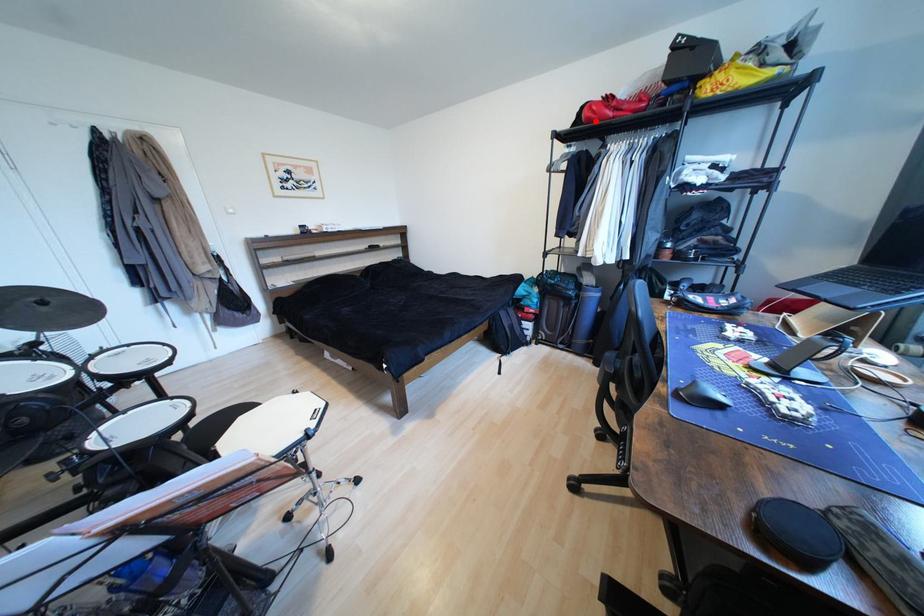
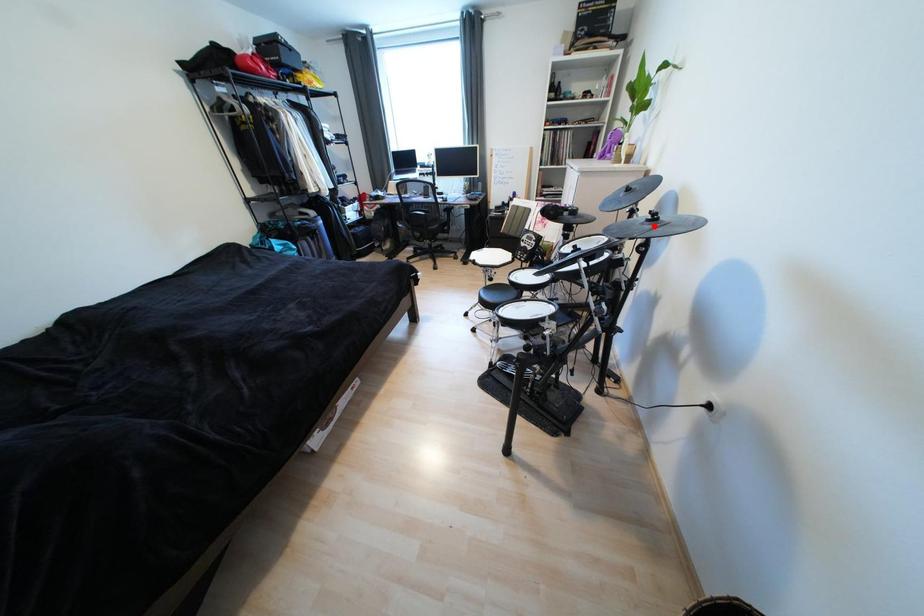
I am providing you with two images of the same scene from different viewpoints. A red point is marked on the first image and another point is marked on the second image. Is the marked point in image1 the same physical position as the marked point in image2?

No